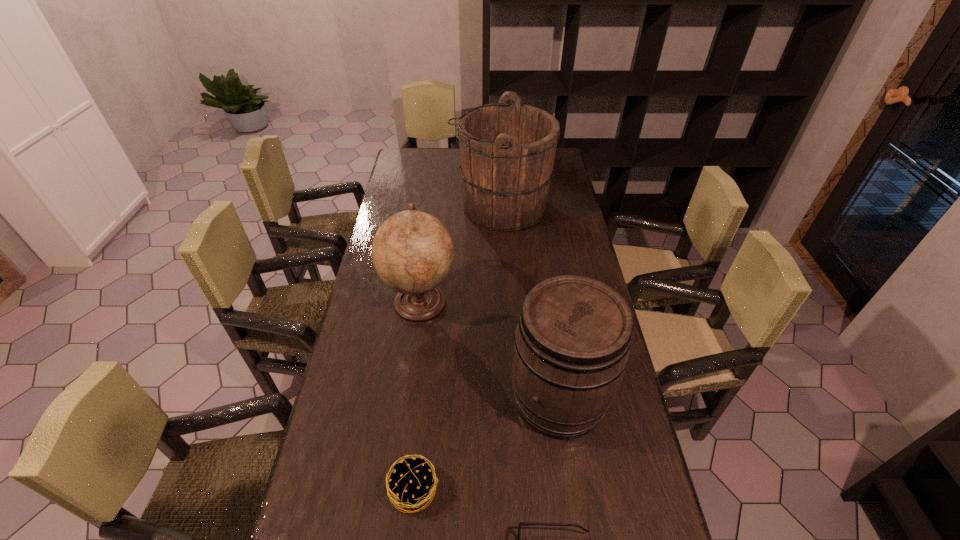
Image resolution: width=960 pixels, height=540 pixels. In order to click on object located at the left edge in this screenshot , I will do `click(412, 252)`.

Image resolution: width=960 pixels, height=540 pixels. I want to click on bucket at the right edge, so click(507, 151).

The width and height of the screenshot is (960, 540). Identify the location of wine bucket that is at the right edge. coord(572,342).

Identify the location of free space at the far edge. (434, 155).

Find the location of a particular element. This screenshot has height=540, width=960. free space at the left edge of the desktop is located at coordinates (392, 340).

Find the location of a particular element. vacant area at the right edge is located at coordinates (551, 219).

Image resolution: width=960 pixels, height=540 pixels. What are the coordinates of `free space at the far left corner of the desktop` in the screenshot? It's located at (420, 153).

Identify the location of vacant region between the third farthest object and the globe. (490, 350).

At what (x,y) coordinates should I click in order to perform the action: click on vacant point located between the globe and the fourth tallest object. Please return your answer as a coordinate pair (x, y). This screenshot has height=540, width=960. Looking at the image, I should click on (418, 395).

Locate an element on the screen. This screenshot has width=960, height=540. free spot between the bucket and the fourth nearest object is located at coordinates (461, 254).